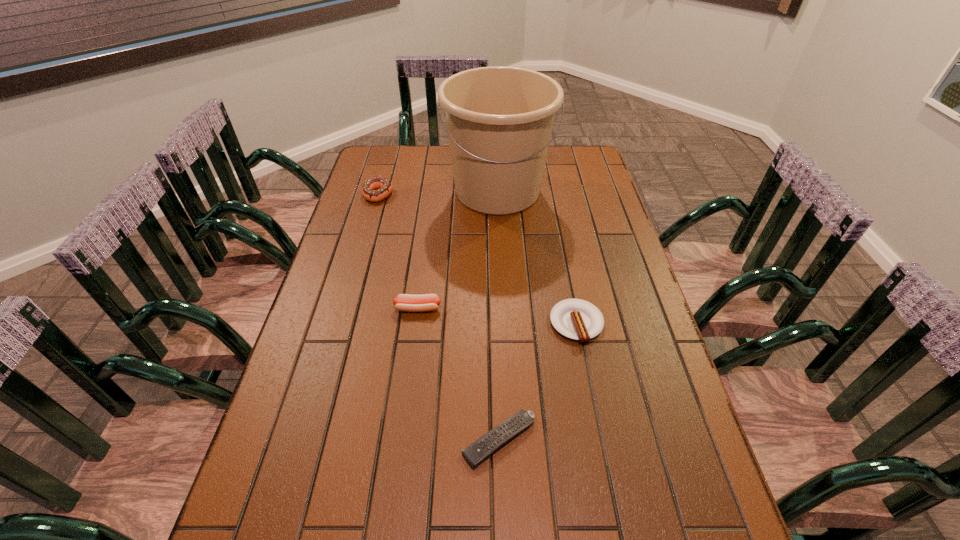
At what (x,y) coordinates should I click in order to perform the action: click on free space between the left sausage and the fourth shortest object. Please return your answer as a coordinate pair (x, y). Looking at the image, I should click on (397, 251).

The image size is (960, 540). Identify the location of unoccupied area between the leftmost object and the right sausage. (477, 259).

This screenshot has width=960, height=540. What are the coordinates of `blank region between the second tallest object and the left sausage` in the screenshot? It's located at (397, 251).

The image size is (960, 540). Find the location of `free space between the left sausage and the tallest object`. free space between the left sausage and the tallest object is located at coordinates (458, 249).

Locate an element on the screen. This screenshot has height=540, width=960. free point between the bucket and the shortest object is located at coordinates (498, 315).

I want to click on free space between the tallest object and the remote control, so click(x=498, y=315).

I want to click on free space between the leftmost object and the right sausage, so click(x=477, y=259).

I want to click on vacant area that lies between the left sausage and the second tallest object, so click(x=397, y=251).

Select which object appears as the fourth closest to the tallest object. Please provide its 2D coordinates. Your answer should be formatted as a tuple, i.e. [(x, y)], where the tuple contains the x and y coordinates of a point satisfying the conditions above.

[(478, 451)]

Identify which object is the third closest to the left sausage. Please provide its 2D coordinates. Your answer should be formatted as a tuple, i.e. [(x, y)], where the tuple contains the x and y coordinates of a point satisfying the conditions above.

[(499, 119)]